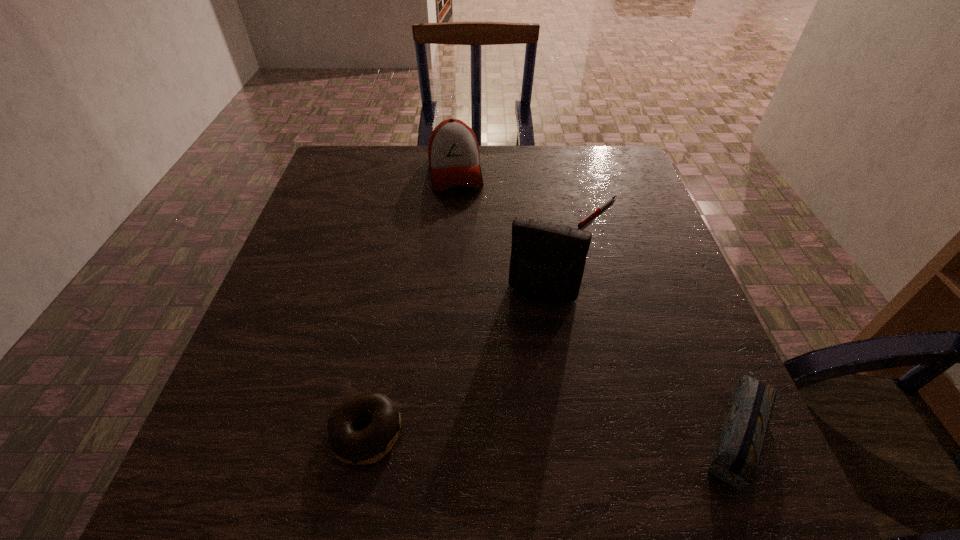
Identify the location of pencil box present at the right edge. (736, 460).

Where is `pen that is at the right edge`? The image size is (960, 540). pen that is at the right edge is located at coordinates (610, 200).

The image size is (960, 540). Identify the location of object present at the near right corner. (736, 460).

In the image, there is a desktop. Where is `free space at the far edge`? free space at the far edge is located at coordinates (510, 183).

Find the location of `vacant position at the near edge of the desktop`. vacant position at the near edge of the desktop is located at coordinates (629, 431).

The image size is (960, 540). In the image, there is a desktop. What are the coordinates of `vacant space at the left edge` in the screenshot? It's located at (312, 204).

In order to click on vacant space at the right edge of the desktop in this screenshot , I will do `click(638, 313)`.

What are the coordinates of `vacant space at the near left corner` in the screenshot? It's located at (277, 429).

At what (x,y) coordinates should I click in order to perform the action: click on vacant space at the far right corner of the desktop. Please return your answer as a coordinate pair (x, y). The image size is (960, 540). Looking at the image, I should click on (609, 178).

You are a GUI agent. You are given a task and a screenshot of the screen. Output one action in this format:
    pyautogui.click(x=<x>, y=<y>)
    Task: Click on the vacant space that's between the fourth tallest object and the pen
    Image resolution: width=960 pixels, height=540 pixels.
    Given the screenshot: What is the action you would take?
    pyautogui.click(x=482, y=322)